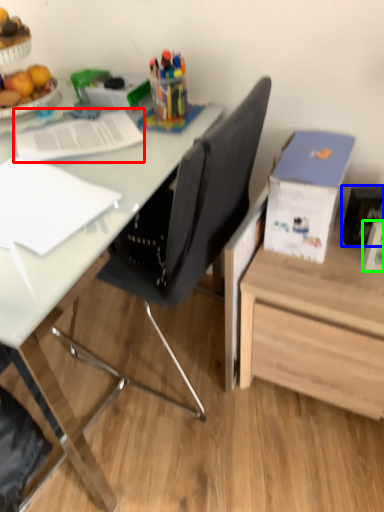
Question: Based on their relative distances, which object is farther from notebook (highlighted by a red box)? Choose from picture frame (highlighted by a blue box) and picture frame (highlighted by a green box).

Choices:
 (A) picture frame
 (B) picture frame

Answer: (B)